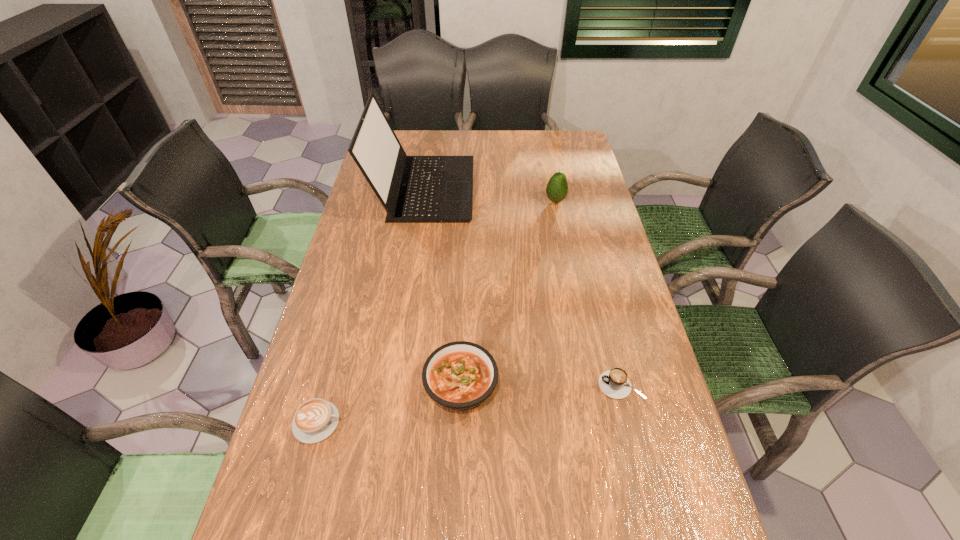
This screenshot has height=540, width=960. Identify the location of vacant area at the far edge of the desktop. (425, 139).

The width and height of the screenshot is (960, 540). I want to click on vacant space at the left edge of the desktop, so click(x=362, y=199).

The height and width of the screenshot is (540, 960). Identify the location of vacant space at the right edge. (663, 437).

Find the location of `vacant region at the far left corner of the desktop`. vacant region at the far left corner of the desktop is located at coordinates (409, 147).

Locate an element on the screen. Image resolution: width=960 pixels, height=540 pixels. vacant area between the nearer cappuccino and the laptop is located at coordinates (371, 305).

Identify the location of free space between the farther cappuccino and the fourth shortest object. This screenshot has height=540, width=960. (588, 293).

Where is `vacant point located between the tallest object and the second tallest object`? vacant point located between the tallest object and the second tallest object is located at coordinates (490, 194).

Locate an element on the screen. vacant area that lies between the tallest object and the farther cappuccino is located at coordinates (522, 287).

The width and height of the screenshot is (960, 540). I want to click on free spot between the laptop and the second tallest object, so click(x=490, y=194).

Image resolution: width=960 pixels, height=540 pixels. In order to click on free area in between the second tallest object and the right cappuccino in this screenshot , I will do `click(588, 293)`.